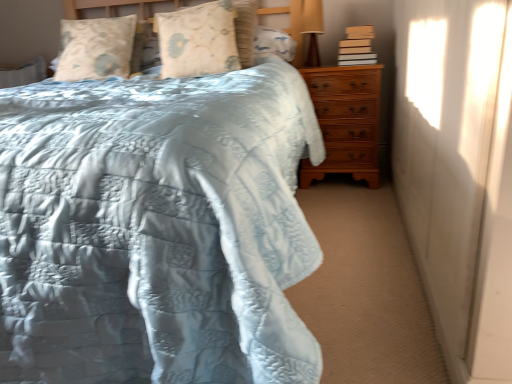
Question: Is light beige fabric pillow at upper left, which ranks as the first pillow in left-to-right order, thinner than matte brown table lamp at upper right?

Choices:
 (A) no
 (B) yes

Answer: (A)

Question: Considering the relative sizes of light beige fabric pillow at upper left, which ranks as the first pillow in left-to-right order, and matte brown table lamp at upper right in the image provided, is light beige fabric pillow at upper left, which ranks as the first pillow in left-to-right order, shorter than matte brown table lamp at upper right?

Choices:
 (A) yes
 (B) no

Answer: (A)

Question: Is light beige fabric pillow at upper left, which ranks as the first pillow in left-to-right order, facing towards matte brown table lamp at upper right?

Choices:
 (A) yes
 (B) no

Answer: (B)

Question: From a real-world perspective, is light beige fabric pillow at upper left, which ranks as the first pillow in left-to-right order, positioned under matte brown table lamp at upper right based on gravity?

Choices:
 (A) no
 (B) yes

Answer: (A)

Question: From the image's perspective, is light beige fabric pillow at upper left, which is counted as the second pillow, starting from the right, above matte brown table lamp at upper right?

Choices:
 (A) yes
 (B) no

Answer: (B)

Question: Can you confirm if light beige fabric pillow at upper left, which ranks as the first pillow in left-to-right order, is positioned to the left of matte brown table lamp at upper right?

Choices:
 (A) yes
 (B) no

Answer: (A)

Question: Does matte brown table lamp at upper right have a greater width compared to light brown cardboard book at upper right?

Choices:
 (A) no
 (B) yes

Answer: (A)

Question: Does matte brown table lamp at upper right lie behind light brown cardboard book at upper right?

Choices:
 (A) no
 (B) yes

Answer: (B)

Question: From a real-world perspective, is matte brown table lamp at upper right located beneath light brown cardboard book at upper right?

Choices:
 (A) no
 (B) yes

Answer: (A)

Question: Is matte brown table lamp at upper right taller than light brown cardboard book at upper right?

Choices:
 (A) no
 (B) yes

Answer: (B)

Question: Does matte brown table lamp at upper right touch light brown cardboard book at upper right?

Choices:
 (A) no
 (B) yes

Answer: (A)

Question: Is the depth of matte brown table lamp at upper right less than that of light brown cardboard book at upper right?

Choices:
 (A) yes
 (B) no

Answer: (B)

Question: Could you tell me if brown wooden chest of drawers at right is turned towards light blue quilted bed at center?

Choices:
 (A) no
 (B) yes

Answer: (B)